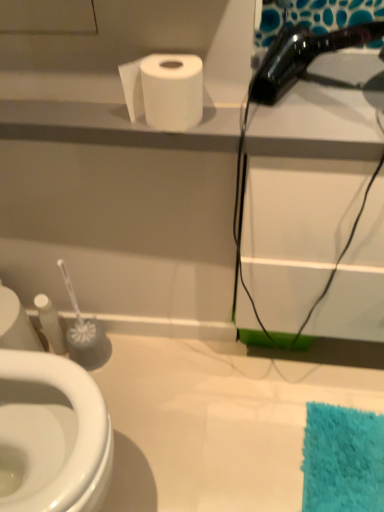
Question: Visually, is white matte toilet paper at upper center positioned to the left or to the right of shiny black hair dryer at upper right?

Choices:
 (A) left
 (B) right

Answer: (A)

Question: From a real-world perspective, relative to shiny black hair dryer at upper right, is white matte toilet paper at upper center vertically above or below?

Choices:
 (A) above
 (B) below

Answer: (B)

Question: From the image's perspective, is white matte toilet paper at upper center positioned above or below shiny black hair dryer at upper right?

Choices:
 (A) above
 (B) below

Answer: (B)

Question: From a real-world perspective, is shiny black hair dryer at upper right positioned above or below white matte toilet paper at upper center?

Choices:
 (A) below
 (B) above

Answer: (B)

Question: Is point (302, 59) positioned closer to the camera than point (173, 70)?

Choices:
 (A) farther
 (B) closer

Answer: (A)

Question: Based on their sizes in the image, would you say shiny black hair dryer at upper right is bigger or smaller than white matte toilet paper at upper center?

Choices:
 (A) big
 (B) small

Answer: (A)

Question: In terms of height, does shiny black hair dryer at upper right look taller or shorter compared to white matte toilet paper at upper center?

Choices:
 (A) short
 (B) tall

Answer: (B)